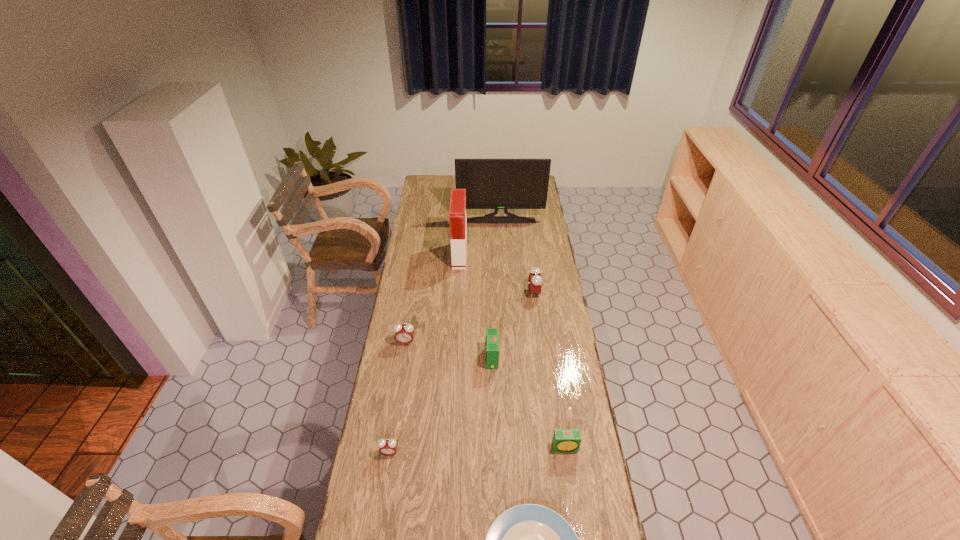
The height and width of the screenshot is (540, 960). What are the coordinates of `pink alarm clock that is the closest to the nearer green alarm clock` in the screenshot? It's located at (388, 447).

Where is `vacant space that satisfies the following two spatial constraints: 1. on the front-facing side of the cigarette_case; 2. on the clock face of the second nearest pink alarm clock`? The image size is (960, 540). vacant space that satisfies the following two spatial constraints: 1. on the front-facing side of the cigarette_case; 2. on the clock face of the second nearest pink alarm clock is located at coordinates (455, 342).

Locate an element on the screen. This screenshot has width=960, height=540. free space that satisfies the following two spatial constraints: 1. on the front-facing side of the farthest object; 2. on the front-facing side of the farther green alarm clock is located at coordinates (509, 358).

This screenshot has width=960, height=540. What are the coordinates of `free space that satisfies the following two spatial constraints: 1. on the front-facing side of the third nearest alarm clock; 2. on the clock face of the smallest pink alarm clock` in the screenshot? It's located at (494, 453).

The width and height of the screenshot is (960, 540). What are the coordinates of `free space that satisfies the following two spatial constraints: 1. on the front-facing side of the cigarette_case; 2. on the clock face of the nearest pink alarm clock` in the screenshot? It's located at (449, 453).